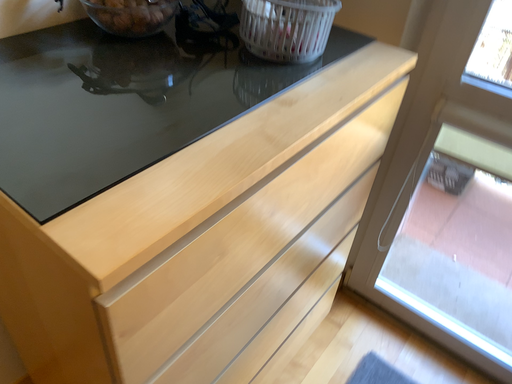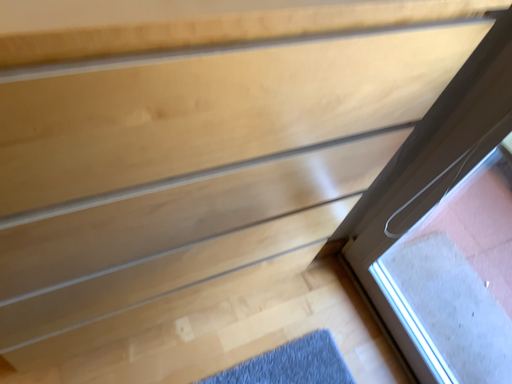
Question: How did the camera likely rotate when shooting the video?

Choices:
 (A) rotated left
 (B) rotated right

Answer: (A)